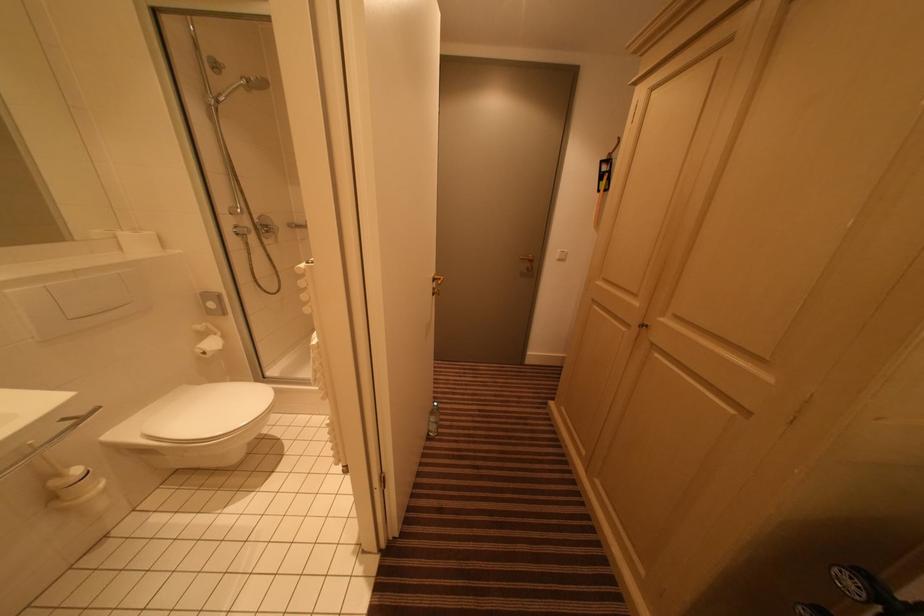
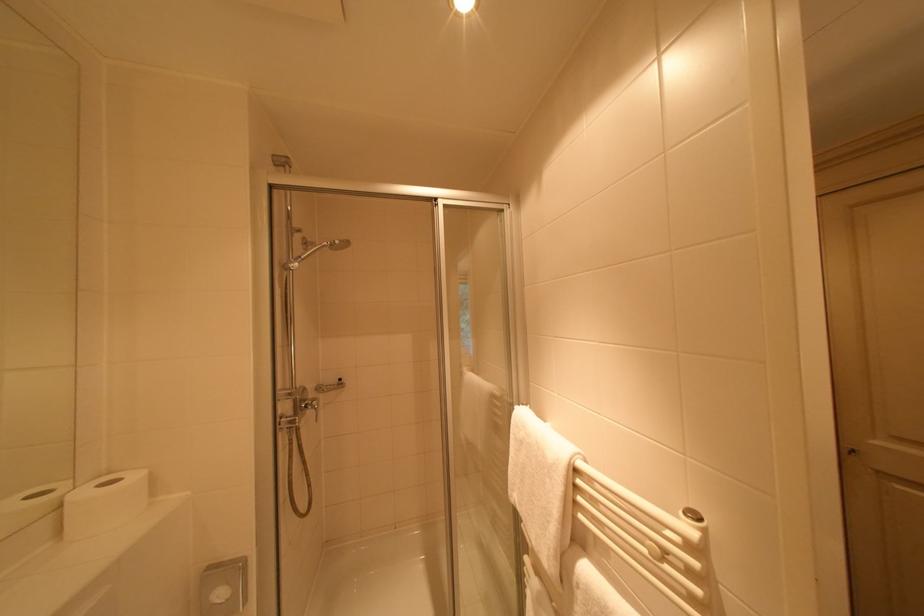
In the second image, find the point that corresponds to (x=219, y=307) in the first image.

(226, 596)